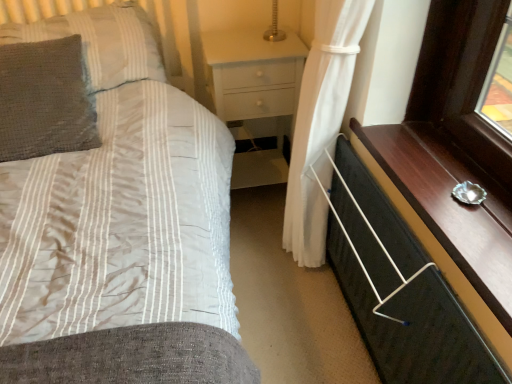
The width and height of the screenshot is (512, 384). I want to click on white fabric curtain at lower right, so click(320, 123).

Measure the distance between point (5, 48) and camera.

Point (5, 48) and camera are 4.81 feet apart from each other.

You are a GUI agent. You are given a task and a screenshot of the screen. Output one action in this format:
    pyautogui.click(x=<x>, y=<y>)
    Task: Click on the white fabric curtain at lower right
    The width and height of the screenshot is (512, 384).
    Given the screenshot: What is the action you would take?
    pyautogui.click(x=320, y=123)

Is the depth of matte striped fabric bed at center greater than that of white fabric curtain at lower right?

No, it is in front of white fabric curtain at lower right.

In the image, is matte striped fabric bed at center on the left side or the right side of white fabric curtain at lower right?

From the image, it's evident that matte striped fabric bed at center is to the left of white fabric curtain at lower right.

Is there a large distance between matte striped fabric bed at center and white fabric curtain at lower right?

Actually, matte striped fabric bed at center and white fabric curtain at lower right are a little close together.

Considering the sizes of objects matte striped fabric bed at center and white fabric curtain at lower right in the image provided, who is shorter, matte striped fabric bed at center or white fabric curtain at lower right?

white fabric curtain at lower right is shorter.

Can matte striped fabric bed at center be found inside gray textured pillow at left, acting as the first pillow starting from the bottom?

No, matte striped fabric bed at center is not surrounded by gray textured pillow at left, acting as the first pillow starting from the bottom.

Who is smaller, gray textured pillow at left, which ranks as the 2th pillow in top-to-bottom order, or matte striped fabric bed at center?

gray textured pillow at left, which ranks as the 2th pillow in top-to-bottom order.

Is gray textured pillow at left, which ranks as the 2th pillow in top-to-bottom order, facing away from matte striped fabric bed at center?

Yes, gray textured pillow at left, which ranks as the 2th pillow in top-to-bottom order, is facing away from matte striped fabric bed at center.

From a real-world perspective, is gray textured pillow at left, which ranks as the 2th pillow in top-to-bottom order, on top of matte striped fabric bed at center?

Yes, from a real-world perspective, gray textured pillow at left, which ranks as the 2th pillow in top-to-bottom order, is above matte striped fabric bed at center.

Is gray textured pillow at upper left, arranged as the 1th pillow when viewed from the top, at the back of white glossy nightstand at center?

→ No, gray textured pillow at upper left, arranged as the 1th pillow when viewed from the top, is not at the back of white glossy nightstand at center.

How far apart are white glossy nightstand at center and gray textured pillow at upper left, positioned as the second pillow in bottom-to-top order?

white glossy nightstand at center and gray textured pillow at upper left, positioned as the second pillow in bottom-to-top order, are 16.46 inches apart.

From their relative heights in the image, would you say white glossy nightstand at center is taller or shorter than gray textured pillow at upper left, arranged as the 1th pillow when viewed from the top?

Clearly, white glossy nightstand at center is taller compared to gray textured pillow at upper left, arranged as the 1th pillow when viewed from the top.

Would you say white glossy nightstand at center is a long distance from gray textured pillow at upper left, arranged as the 1th pillow when viewed from the top?

Actually, white glossy nightstand at center and gray textured pillow at upper left, arranged as the 1th pillow when viewed from the top, are a little close together.

Looking at this image, from their relative heights in the image, would you say black fabric chest of drawers at lower right is taller or shorter than gray textured pillow at left, acting as the first pillow starting from the bottom?

Clearly, black fabric chest of drawers at lower right is taller compared to gray textured pillow at left, acting as the first pillow starting from the bottom.

Looking at their sizes, would you say black fabric chest of drawers at lower right is wider or thinner than gray textured pillow at left, which ranks as the 2th pillow in top-to-bottom order?

black fabric chest of drawers at lower right is thinner than gray textured pillow at left, which ranks as the 2th pillow in top-to-bottom order.

Is point (333, 215) positioned before point (35, 129)?

No, it is behind (35, 129).

From the image's perspective, is black fabric chest of drawers at lower right over gray textured pillow at left, which ranks as the 2th pillow in top-to-bottom order?

No, from the image's perspective, black fabric chest of drawers at lower right is not over gray textured pillow at left, which ranks as the 2th pillow in top-to-bottom order.

Consider the image. Is the surface of black fabric chest of drawers at lower right in direct contact with gray textured pillow at upper left, arranged as the 1th pillow when viewed from the top?

They are not placed beside each other.

Between black fabric chest of drawers at lower right and gray textured pillow at upper left, arranged as the 1th pillow when viewed from the top, which one has larger width?

Wider between the two is gray textured pillow at upper left, arranged as the 1th pillow when viewed from the top.

Considering the sizes of objects black fabric chest of drawers at lower right and gray textured pillow at upper left, arranged as the 1th pillow when viewed from the top, in the image provided, who is bigger, black fabric chest of drawers at lower right or gray textured pillow at upper left, arranged as the 1th pillow when viewed from the top,?

gray textured pillow at upper left, arranged as the 1th pillow when viewed from the top.

Measure the distance from gray textured pillow at upper left, positioned as the second pillow in bottom-to-top order, to matte striped fabric bed at center.

They are 30.53 centimeters apart.

Is gray textured pillow at upper left, positioned as the second pillow in bottom-to-top order, at the right side of matte striped fabric bed at center?

No, gray textured pillow at upper left, positioned as the second pillow in bottom-to-top order, is not to the right of matte striped fabric bed at center.

Is matte striped fabric bed at center inside gray textured pillow at upper left, positioned as the second pillow in bottom-to-top order?

Actually, matte striped fabric bed at center is outside gray textured pillow at upper left, positioned as the second pillow in bottom-to-top order.

Between gray textured pillow at upper left, arranged as the 1th pillow when viewed from the top, and matte striped fabric bed at center, which one has smaller width?

With smaller width is gray textured pillow at upper left, arranged as the 1th pillow when viewed from the top.

Looking at this image, from a real-world perspective, between white fabric curtain at lower right and white glossy nightstand at center, who is vertically higher?

white fabric curtain at lower right, from a real-world perspective.

From the image's perspective, does white fabric curtain at lower right appear lower than white glossy nightstand at center?

Indeed, from the image's perspective, white fabric curtain at lower right is shown beneath white glossy nightstand at center.

In terms of size, does white fabric curtain at lower right appear bigger or smaller than white glossy nightstand at center?

Considering their sizes, white fabric curtain at lower right takes up less space than white glossy nightstand at center.

Does white fabric curtain at lower right turn towards white glossy nightstand at center?

No, white fabric curtain at lower right is not aimed at white glossy nightstand at center.

This screenshot has height=384, width=512. I want to click on curtain that appears behind the matte striped fabric bed at center, so click(320, 123).

Identify the location of bed below the gray textured pillow at left, acting as the first pillow starting from the bottom (from a real-world perspective). (121, 229).

Looking at the image, which one is located closer to matte striped fabric bed at center, white fabric curtain at lower right or gray textured pillow at upper left, arranged as the 1th pillow when viewed from the top?

The object closer to matte striped fabric bed at center is gray textured pillow at upper left, arranged as the 1th pillow when viewed from the top.

Looking at this image, when comparing their distances from white fabric curtain at lower right, does black fabric chest of drawers at lower right or gray textured pillow at upper left, positioned as the second pillow in bottom-to-top order, seem further?

gray textured pillow at upper left, positioned as the second pillow in bottom-to-top order, is positioned further to the anchor white fabric curtain at lower right.

From the image, which object appears to be nearer to matte striped fabric bed at center, gray textured pillow at upper left, positioned as the second pillow in bottom-to-top order, or white fabric curtain at lower right?

gray textured pillow at upper left, positioned as the second pillow in bottom-to-top order.

Estimate the real-world distances between objects in this image. Which object is closer to white fabric curtain at lower right, matte striped fabric bed at center or white glossy nightstand at center?

white glossy nightstand at center lies closer to white fabric curtain at lower right than the other object.

Considering their positions, is gray textured pillow at left, which ranks as the 2th pillow in top-to-bottom order, positioned closer to white glossy nightstand at center than white fabric curtain at lower right?

Among the two, white fabric curtain at lower right is located nearer to white glossy nightstand at center.

Looking at the image, which one is located closer to white glossy nightstand at center, gray textured pillow at left, which ranks as the 2th pillow in top-to-bottom order, or gray textured pillow at upper left, arranged as the 1th pillow when viewed from the top?

The object closer to white glossy nightstand at center is gray textured pillow at upper left, arranged as the 1th pillow when viewed from the top.

Considering their positions, is white fabric curtain at lower right positioned closer to white glossy nightstand at center than gray textured pillow at upper left, arranged as the 1th pillow when viewed from the top?

gray textured pillow at upper left, arranged as the 1th pillow when viewed from the top, lies closer to white glossy nightstand at center than the other object.

From the image, which object appears to be farther from white glossy nightstand at center, gray textured pillow at upper left, arranged as the 1th pillow when viewed from the top, or black fabric chest of drawers at lower right?

black fabric chest of drawers at lower right.

In order to click on curtain between matte striped fabric bed at center and gray textured pillow at left, which ranks as the 2th pillow in top-to-bottom order, from front to back in this screenshot , I will do `click(320, 123)`.

Find the location of a particular element. The image size is (512, 384). pillow between matte striped fabric bed at center and gray textured pillow at upper left, positioned as the second pillow in bottom-to-top order, in the front-back direction is located at coordinates (44, 100).

I want to click on the chest of drawers located between matte striped fabric bed at center and white glossy nightstand at center in the depth direction, so [x=413, y=325].

I want to click on chest of drawers between matte striped fabric bed at center and gray textured pillow at upper left, positioned as the second pillow in bottom-to-top order, in the front-back direction, so click(413, 325).